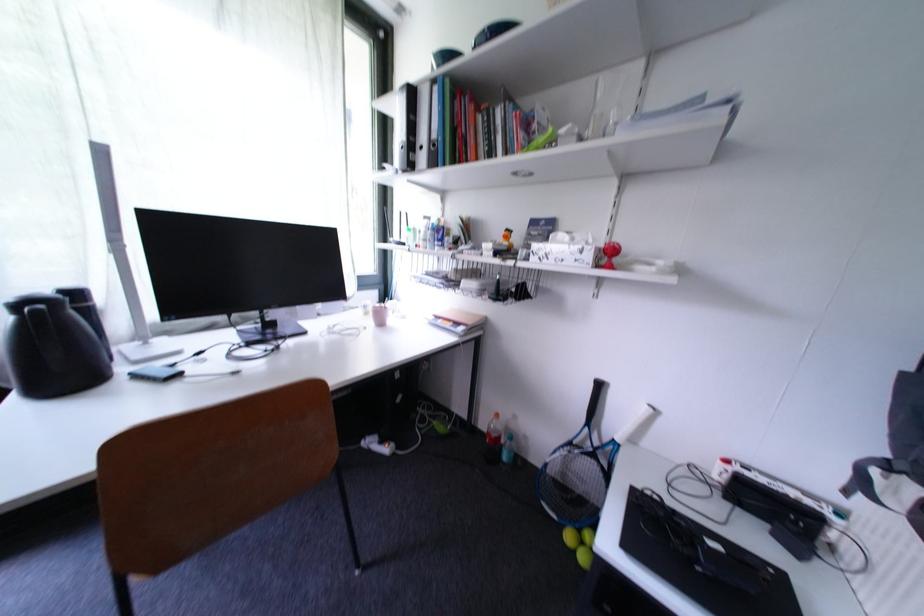
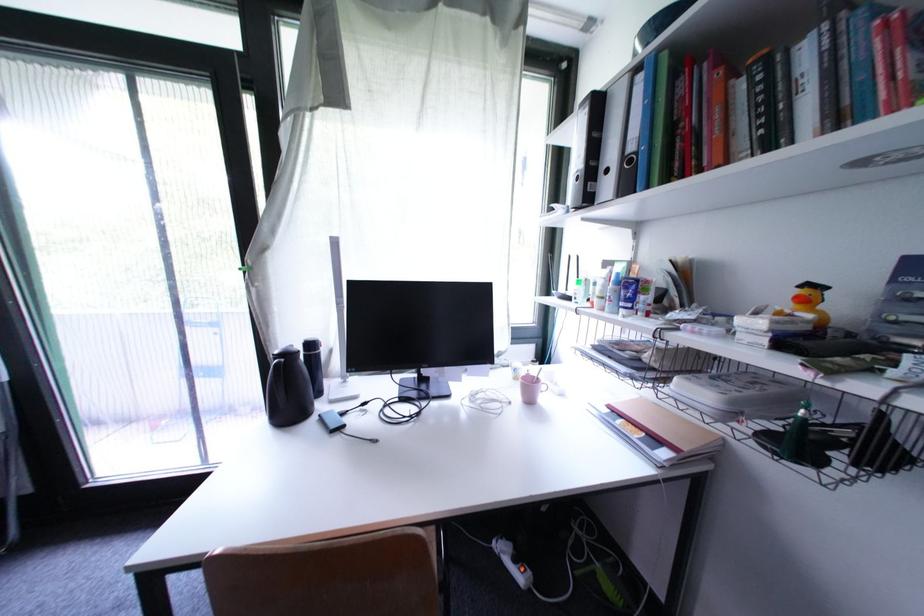
Question: The camera is either moving clockwise (left) or counter-clockwise (right) around the object. The first image is from the beginning of the video and the second image is from the end. Is the camera moving left or right when shooting the video?

Choices:
 (A) Left
 (B) Right

Answer: (B)